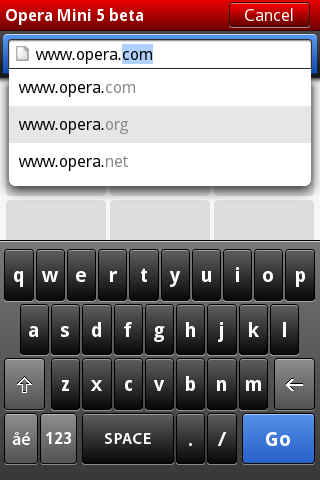
This screenshot has width=320, height=480. Find the location of `keyboard background`. keyboard background is located at coordinates (307, 346).